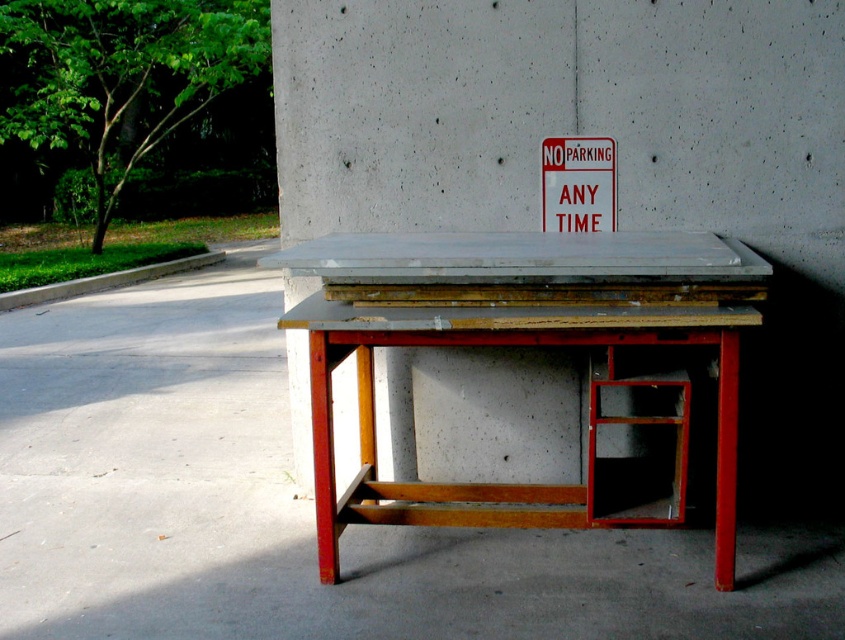
You are standing at the camera position and want to place a 6.5 feet long ladder diagonally on the wooden table at center. Is the table long enough to fit the ladder?

The wooden table at center and camera are 6.68 feet apart. Since the ladder is 6.5 feet long, the table is slightly longer than the ladder, so it can fit diagonally.

Consider the image. You are standing at the edge of the paved area and see both the smooth concrete pillar at center and the wooden table at center. Which object is positioned to the right when viewed from your perspective?

The smooth concrete pillar at center is positioned to the right of the wooden table at center from your perspective.

You are standing at a point 7.01 feet away from the camera. You want to place a small tool on the workbench so that it is exactly halfway between the point marked at coordinates point (x=448, y=317) and the edge of the workbench. Is this possible?

The point marked at coordinates point (x=448, y=317) is 7.01 feet away from the camera. However, without knowing the dimensions of the workbench or the exact location of its edges, it is impossible to determine if placing the tool halfway between the point and the edge is feasible. Additional measurements are required.